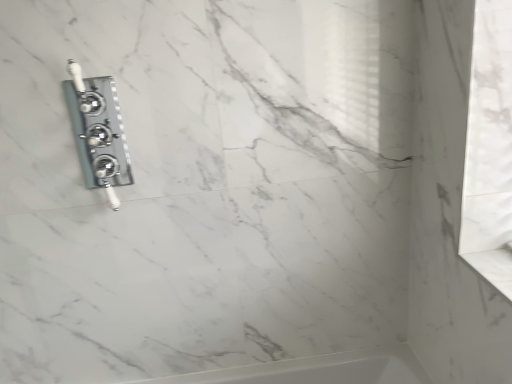
Image resolution: width=512 pixels, height=384 pixels. Describe the element at coordinates (98, 132) in the screenshot. I see `satin nickel faucet at upper left` at that location.

Find the location of `satin nickel faucet at upper left`. satin nickel faucet at upper left is located at coordinates (98, 132).

Where is `satin nickel faucet at upper left`? The height and width of the screenshot is (384, 512). satin nickel faucet at upper left is located at coordinates (98, 132).